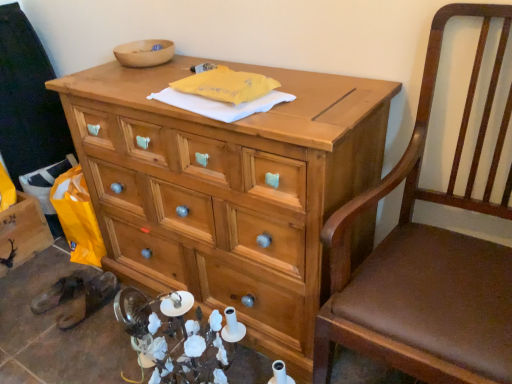
Image resolution: width=512 pixels, height=384 pixels. Describe the element at coordinates (22, 232) in the screenshot. I see `wooden crate at lower left` at that location.

The width and height of the screenshot is (512, 384). Find the location of `wooden bowl at upper center`. wooden bowl at upper center is located at coordinates (144, 53).

The height and width of the screenshot is (384, 512). I want to click on brown leather chair at right, so click(428, 257).

Are brown leather chair at right and wooden crate at lower left located far from each other?

Indeed, brown leather chair at right is not near wooden crate at lower left.

Is brown leather chair at right facing towards wooden crate at lower left?

No, brown leather chair at right is not turned towards wooden crate at lower left.

Which object is thinner, brown leather chair at right or wooden crate at lower left?

wooden crate at lower left is thinner.

From the image's perspective, is natural wood desk at center on wooden bowl at upper center?

No.

From a real-world perspective, which object stands above the other?

wooden bowl at upper center.

Locate an element on the screen. The height and width of the screenshot is (384, 512). desk beneath the wooden bowl at upper center (from a real-world perspective) is located at coordinates (227, 189).

Could you tell me if wooden crate at lower left is facing brown leather sandals at lower left?

Yes, wooden crate at lower left is turned towards brown leather sandals at lower left.

Is wooden crate at lower left beside brown leather sandals at lower left?

No, wooden crate at lower left is not in contact with brown leather sandals at lower left.

Looking at the image, does wooden crate at lower left seem bigger or smaller compared to brown leather sandals at lower left?

Considering their sizes, wooden crate at lower left takes up more space than brown leather sandals at lower left.

Is natural wood desk at center facing away from brown leather chair at right?

That's not correct — natural wood desk at center is not looking away from brown leather chair at right.

Is natural wood desk at center wider than brown leather chair at right?

No, natural wood desk at center is not wider than brown leather chair at right.

Can you confirm if natural wood desk at center is taller than brown leather chair at right?

In fact, natural wood desk at center may be shorter than brown leather chair at right.

From a real-world perspective, which is physically above, natural wood desk at center or brown leather chair at right?

brown leather chair at right.

Between natural wood desk at center and brown leather sandals at lower left, which one has larger size?

Bigger between the two is natural wood desk at center.

Considering the positions of points (289, 370) and (112, 287), is point (289, 370) farther from camera compared to point (112, 287)?

No.

Is brown leather sandals at lower left at the back of natural wood desk at center?

natural wood desk at center is not turned away from brown leather sandals at lower left.

From a real-world perspective, who is located lower, natural wood desk at center or brown leather sandals at lower left?

brown leather sandals at lower left is physically lower.

Can you confirm if brown leather sandals at lower left is shorter than wooden crate at lower left?

Yes.

Which object is further away from the camera taking this photo, brown leather sandals at lower left or wooden crate at lower left?

Positioned behind is wooden crate at lower left.

Is brown leather sandals at lower left turned away from wooden crate at lower left?

brown leather sandals at lower left does not have its back to wooden crate at lower left.

What's the angular difference between brown leather chair at right and wooden bowl at upper center's facing directions?

2.69 degrees separate the facing orientations of brown leather chair at right and wooden bowl at upper center.

Does brown leather chair at right have a greater width compared to wooden bowl at upper center?

Indeed, brown leather chair at right has a greater width compared to wooden bowl at upper center.

Considering the positions of point (472, 339) and point (139, 62), is point (472, 339) closer or farther from the camera than point (139, 62)?

Point (472, 339) is positioned closer to the camera compared to point (139, 62).

From the image's perspective, is brown leather chair at right located above or below wooden bowl at upper center?

Clearly, from the image's perspective, brown leather chair at right is below wooden bowl at upper center.

You are a GUI agent. You are given a task and a screenshot of the screen. Output one action in this format:
    pyautogui.click(x=<x>, y=<y>)
    Task: Click on the chair in front of the wooden crate at lower left
    This screenshot has height=384, width=512.
    Given the screenshot: What is the action you would take?
    pyautogui.click(x=428, y=257)

The width and height of the screenshot is (512, 384). What are the coordinates of `bowl behind the natural wood desk at center` in the screenshot? It's located at (144, 53).

Considering their positions, is brown leather sandals at lower left positioned closer to wooden crate at lower left than wooden bowl at upper center?

Among the two, brown leather sandals at lower left is located nearer to wooden crate at lower left.

In the scene shown: Which object lies nearer to the anchor point natural wood desk at center, wooden bowl at upper center or brown leather chair at right?

Among the two, brown leather chair at right is located nearer to natural wood desk at center.

Which object lies further to the anchor point wooden bowl at upper center, wooden crate at lower left or brown leather chair at right?

brown leather chair at right lies further to wooden bowl at upper center than the other object.

Considering their positions, is wooden bowl at upper center positioned further to brown leather chair at right than natural wood desk at center?

Among the two, wooden bowl at upper center is located further to brown leather chair at right.

Considering their positions, is brown leather sandals at lower left positioned further to natural wood desk at center than wooden bowl at upper center?

Based on the image, brown leather sandals at lower left appears to be further to natural wood desk at center.

When comparing their distances from wooden bowl at upper center, does brown leather sandals at lower left or brown leather chair at right seem further?

brown leather chair at right is positioned further to the anchor wooden bowl at upper center.

Considering their positions, is brown leather chair at right positioned closer to natural wood desk at center than wooden bowl at upper center?

brown leather chair at right.

From the image, which object appears to be nearer to natural wood desk at center, wooden bowl at upper center or brown leather sandals at lower left?

The object closer to natural wood desk at center is wooden bowl at upper center.

Where is `desk located between wooden crate at lower left and brown leather chair at right in the left-right direction`? desk located between wooden crate at lower left and brown leather chair at right in the left-right direction is located at coordinates (227, 189).

You are a GUI agent. You are given a task and a screenshot of the screen. Output one action in this format:
    pyautogui.click(x=<x>, y=<y>)
    Task: Click on the bowl situated between wooden crate at lower left and natural wood desk at center from left to right
    The image size is (512, 384).
    Given the screenshot: What is the action you would take?
    pyautogui.click(x=144, y=53)

In order to click on cabinetry between wooden bowl at upper center and brown leather sandals at lower left in the vertical direction in this screenshot , I will do `click(22, 232)`.

You are a GUI agent. You are given a task and a screenshot of the screen. Output one action in this format:
    pyautogui.click(x=<x>, y=<y>)
    Task: Click on the desk between brown leather chair at right and wooden bowl at upper center along the z-axis
    The width and height of the screenshot is (512, 384).
    Given the screenshot: What is the action you would take?
    pyautogui.click(x=227, y=189)